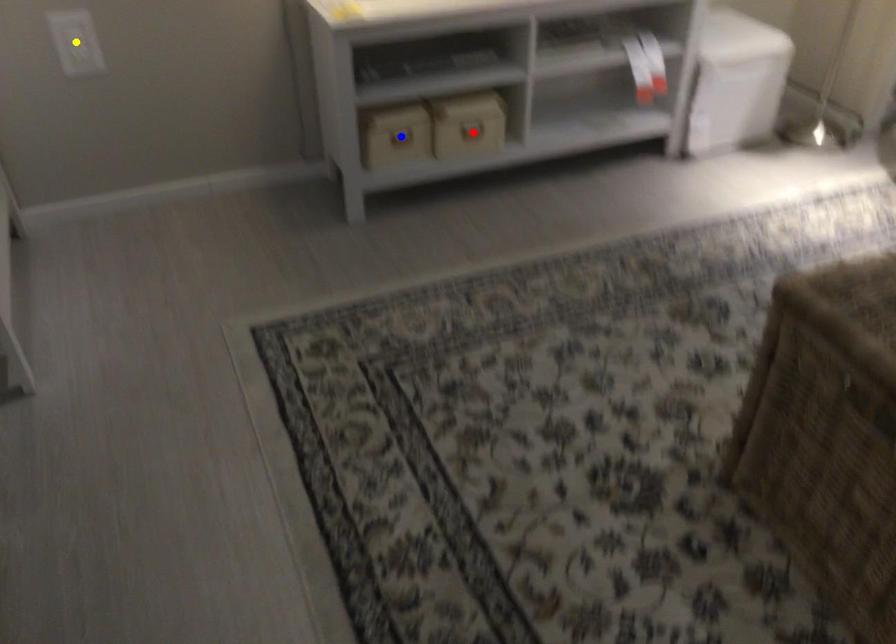
Order these from nearest to farthest:
- yellow point
- blue point
- red point

yellow point, blue point, red point